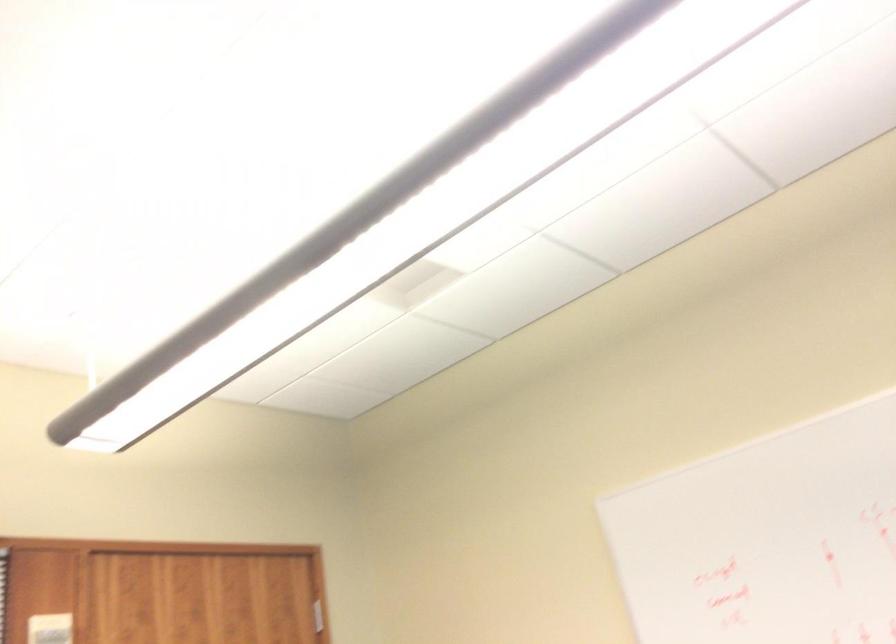
Where is `door handle`? This screenshot has width=896, height=644. door handle is located at coordinates (49, 629).